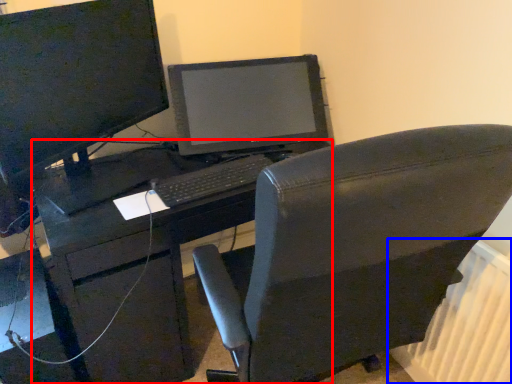
Question: Which object appears farthest to the camera in this image, desk (highlighted by a red box) or radiator (highlighted by a blue box)?

Choices:
 (A) desk
 (B) radiator

Answer: (A)